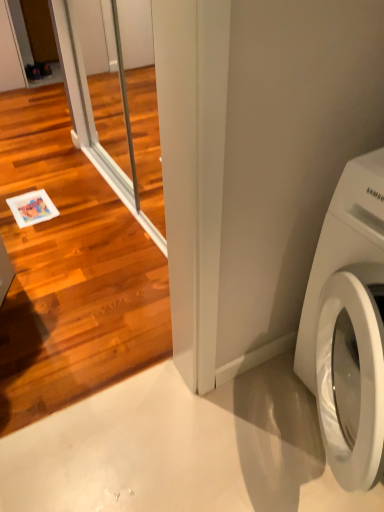
Question: From their relative heights in the image, would you say clear glass screen door at upper left, which ranks as the second screen door in back-to-front order, is taller or shorter than clear glass screen door at left, positioned as the first screen door in back-to-front order?

Choices:
 (A) short
 (B) tall

Answer: (B)

Question: From the image's perspective, relative to clear glass screen door at left, arranged as the second screen door when viewed from the front, is clear glass screen door at upper left, the 1th screen door positioned from the front, above or below?

Choices:
 (A) above
 (B) below

Answer: (B)

Question: Estimate the real-world distances between objects in this image. Which object is closer to the clear glass screen door at left, positioned as the first screen door in back-to-front order?

Choices:
 (A) white glossy washing machine at lower right
 (B) clear glass screen door at upper left, which ranks as the second screen door in back-to-front order

Answer: (B)

Question: Estimate the real-world distances between objects in this image. Which object is closer to the white glossy washing machine at lower right?

Choices:
 (A) clear glass screen door at left, positioned as the first screen door in back-to-front order
 (B) clear glass screen door at upper left, which ranks as the second screen door in back-to-front order

Answer: (B)